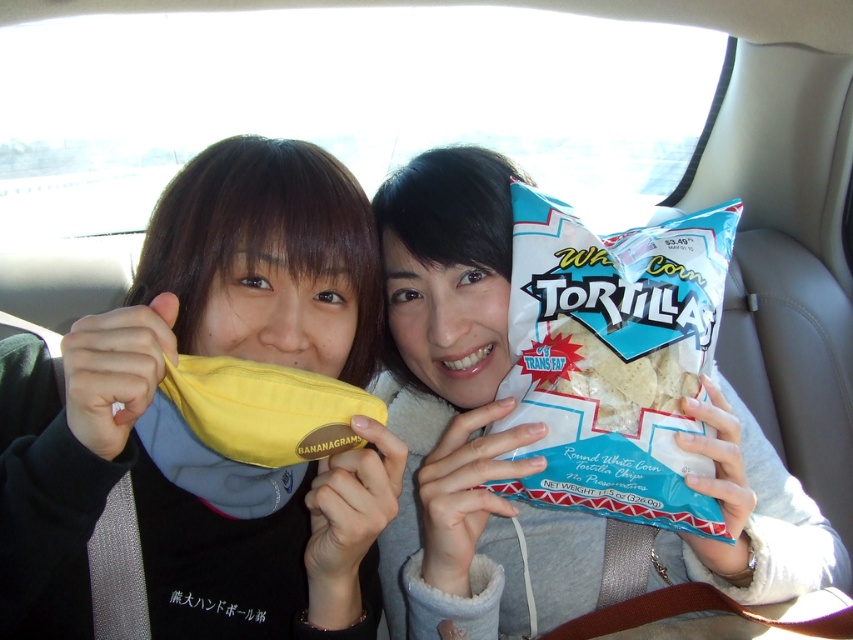
Question: Which of the following is the farthest from the observer?

Choices:
 (A) (619, 368)
 (B) (788, 566)

Answer: (B)

Question: Is yellow fabric bag at center below white corn tortilla at center?

Choices:
 (A) yes
 (B) no

Answer: (A)

Question: Can you confirm if yellow fabric neck warmer at center is positioned above yellow fabric bag at center?

Choices:
 (A) no
 (B) yes

Answer: (B)

Question: Does yellow fabric neck warmer at center appear on the left side of white paper tortilla chips at center?

Choices:
 (A) yes
 (B) no

Answer: (A)

Question: Considering the real-world distances, which object is closest to the white corn tortilla at center?

Choices:
 (A) yellow fabric bag at center
 (B) yellow fabric neck warmer at center
 (C) white paper tortilla chips at center

Answer: (C)

Question: Which object appears farthest from the camera in this image?

Choices:
 (A) yellow fabric bag at center
 (B) white corn tortilla at center
 (C) yellow fabric neck warmer at center

Answer: (B)